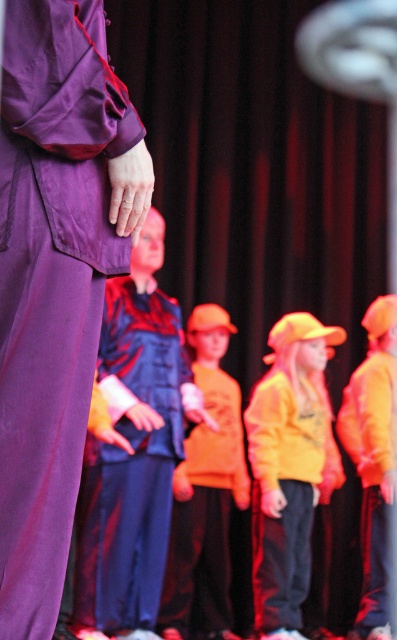
Can you confirm if velvet blue robe at center is positioned below orange matte shirt at center?

No.

This screenshot has height=640, width=397. What do you see at coordinates (131, 465) in the screenshot?
I see `velvet blue robe at center` at bounding box center [131, 465].

In order to click on velvet blue robe at center in this screenshot , I will do `click(131, 465)`.

Who is positioned more to the left, matte yellow hoodie at center or orange matte shirt at center?

orange matte shirt at center

Locate an element on the screen. matte yellow hoodie at center is located at coordinates (287, 468).

Who is more distant from viewer, (96, 323) or (368, 548)?

Positioned behind is point (368, 548).

Describe the element at coordinates (55, 276) in the screenshot. I see `purple matte robe at left` at that location.

Identify the location of purple matte robe at left. The image size is (397, 640). (55, 276).